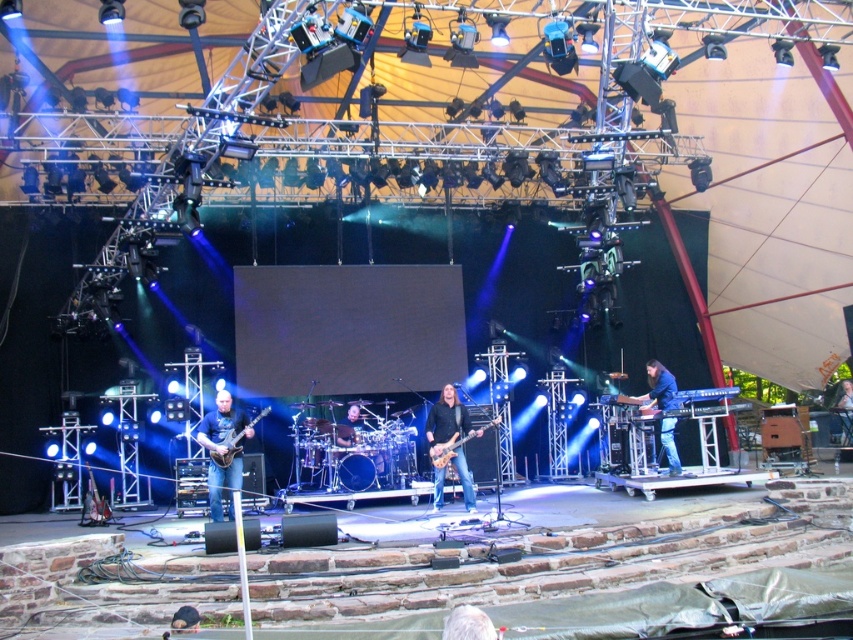
Which is above, matte black guitar at center or white fabric shirt at center?

white fabric shirt at center is above.

Who is more forward, (235, 413) or (846, 444)?

Positioned in front is point (235, 413).

At what (x,y) coordinates should I click in order to perform the action: click on matte black guitar at center. Please return your answer as a coordinate pair (x, y). The image size is (853, 640). Looking at the image, I should click on (222, 451).

Is blue denim jeans at lower right below gray hair at lower center?

Actually, blue denim jeans at lower right is above gray hair at lower center.

The height and width of the screenshot is (640, 853). Find the location of `blue denim jeans at lower right`. blue denim jeans at lower right is located at coordinates tap(659, 387).

Is black leather jacket at center to the right of shiny black electric guitar at left from the viewer's perspective?

Correct, you'll find black leather jacket at center to the right of shiny black electric guitar at left.

Does point (445, 394) come in front of point (247, 428)?

No.

I want to click on black leather jacket at center, so click(x=447, y=420).